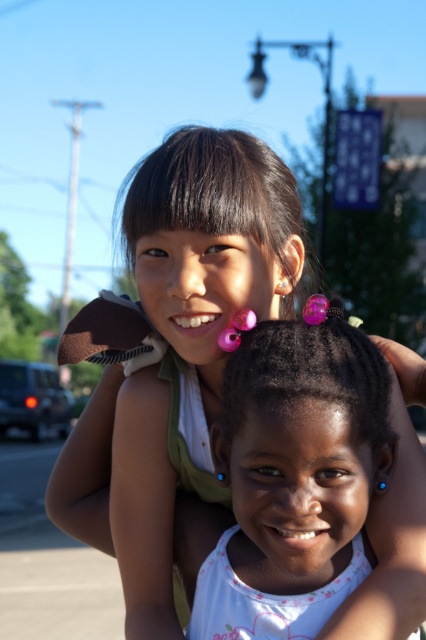
Question: Among these objects, which one is nearest to the camera?

Choices:
 (A) purple glossy hair at center
 (B) black shiny hair at upper center

Answer: (A)

Question: Considering the relative positions of matte green shirt at upper center and pink hair clips at center in the image provided, where is matte green shirt at upper center located with respect to pink hair clips at center?

Choices:
 (A) below
 (B) above

Answer: (B)

Question: Which point is farther to the camera?

Choices:
 (A) (203, 609)
 (B) (333, 376)

Answer: (A)

Question: Can you confirm if pink hair clips at center is smaller than black shiny hair at upper center?

Choices:
 (A) no
 (B) yes

Answer: (B)

Question: Which point is closer to the camera?

Choices:
 (A) (181, 289)
 (B) (215, 429)
 (C) (244, 368)
 (D) (233, 205)

Answer: (C)

Question: Considering the relative positions of pink hair clips at center and purple glossy hair at center in the image provided, where is pink hair clips at center located with respect to purple glossy hair at center?

Choices:
 (A) above
 (B) below

Answer: (B)